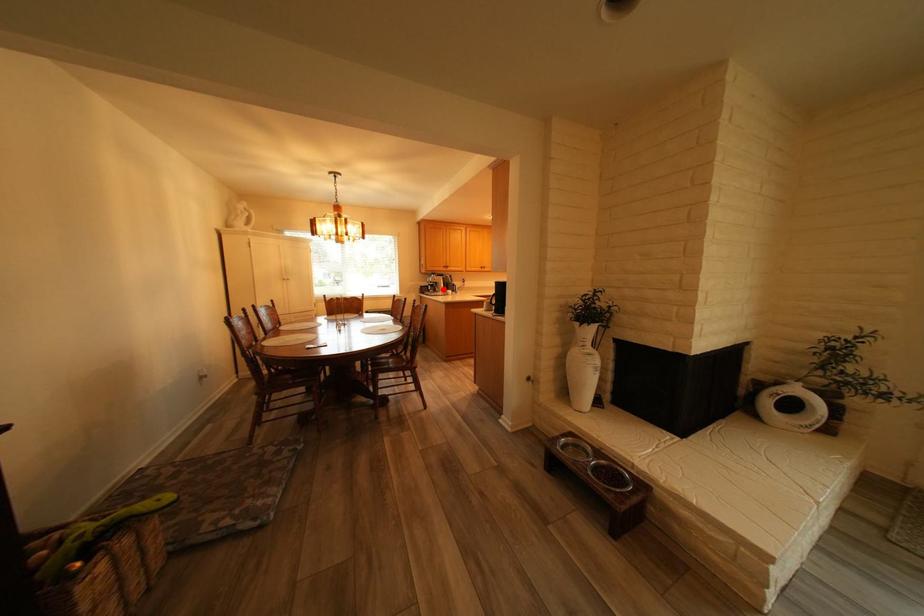
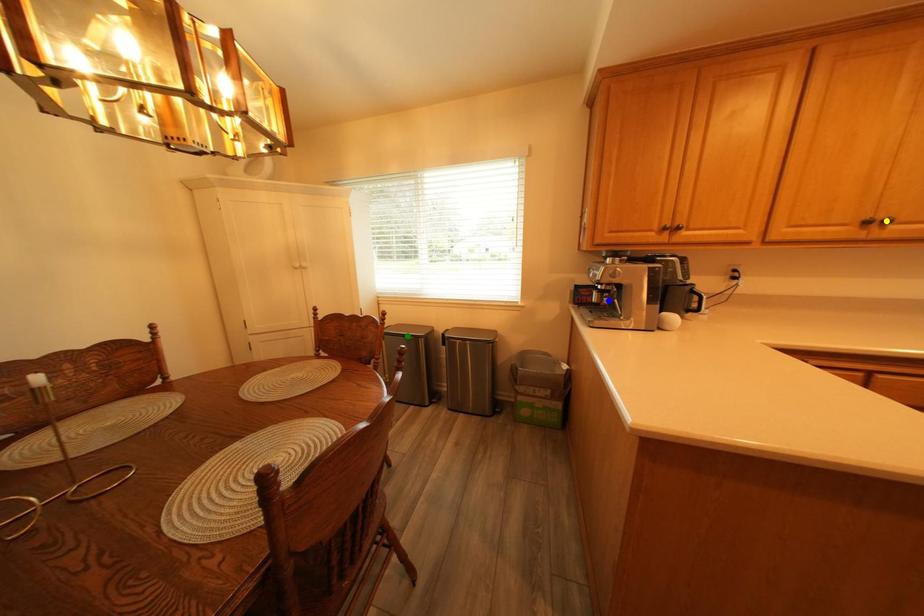
Question: I am providing you with two images of the same scene from different viewpoints. A red point is marked on the first image. You are given multiple points on the second image. Which spot in image 2 lines up with the point in image 1?

Choices:
 (A) green point
 (B) blue point
 (C) yellow point

Answer: (B)